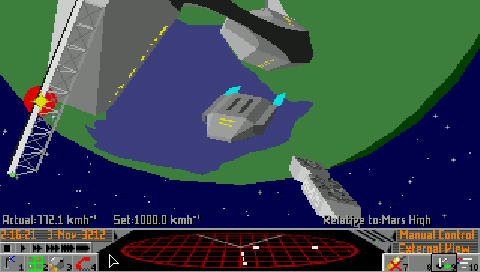
Where is `object that looks like a ladder`? object that looks like a ladder is located at coordinates (70, 64).